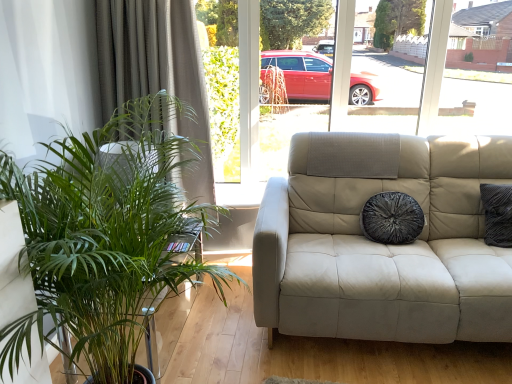
Image resolution: width=512 pixels, height=384 pixels. What do you see at coordinates (106, 236) in the screenshot? I see `green leafy plant at left` at bounding box center [106, 236].

Where is `green fabric curtain at left`? green fabric curtain at left is located at coordinates (157, 72).

Would you say green fabric curtain at left is to the left or to the right of green leafy plant at left in the picture?

From the image, it's evident that green fabric curtain at left is to the left of green leafy plant at left.

In terms of height, does green fabric curtain at left look taller or shorter compared to green leafy plant at left?

Clearly, green fabric curtain at left is taller compared to green leafy plant at left.

Is point (174, 20) positioned before point (21, 175)?

No.

From a real-world perspective, is green fabric curtain at left above or below green leafy plant at left?

From a real-world perspective, green fabric curtain at left is physically above green leafy plant at left.

Which of these two, velvety black pillow at center or green fabric curtain at left, is smaller?

velvety black pillow at center is smaller.

Is velvety black pillow at center spatially inside green fabric curtain at left, or outside of it?

velvety black pillow at center exists outside the volume of green fabric curtain at left.

Which object is positioned more to the left, velvety black pillow at center or green fabric curtain at left?

Positioned to the left is green fabric curtain at left.

Considering the positions of objects velvety black pillow at center and green fabric curtain at left in the image provided, who is behind, velvety black pillow at center or green fabric curtain at left?

green fabric curtain at left is more distant.

From a real-world perspective, does green leafy plant at left stand above velvety black pillow at center?

Correct, in the physical world, green leafy plant at left is higher than velvety black pillow at center.

Is green leafy plant at left at the left side of velvety black pillow at center?

Indeed, green leafy plant at left is positioned on the left side of velvety black pillow at center.

From the image's perspective, is green leafy plant at left located above velvety black pillow at center?

No, from the image's perspective, green leafy plant at left is not above velvety black pillow at center.

Considering the sizes of velvety black pillow at center and green leafy plant at left in the image, is velvety black pillow at center taller or shorter than green leafy plant at left?

In the image, velvety black pillow at center appears to be shorter than green leafy plant at left.

Considering the positions of point (393, 243) and point (106, 153), is point (393, 243) closer or farther from the camera than point (106, 153)?

Point (393, 243) is farther from the camera than point (106, 153).

How many degrees apart are the facing directions of velvety black pillow at center and green leafy plant at left?

96.1 degrees separate the facing orientations of velvety black pillow at center and green leafy plant at left.

Is velvety black pillow at center oriented away from green leafy plant at left?

No, velvety black pillow at center is not facing away from green leafy plant at left.

Is green leafy plant at left shorter than green fabric curtain at left?

Indeed, green leafy plant at left has a lesser height compared to green fabric curtain at left.

From a real-world perspective, which object stands above the other?

green fabric curtain at left.

Does green leafy plant at left have a lesser width compared to green fabric curtain at left?

No, green leafy plant at left is not thinner than green fabric curtain at left.

From the image's perspective, is green leafy plant at left below green fabric curtain at left?

Indeed, from the image's perspective, green leafy plant at left is shown beneath green fabric curtain at left.

Looking at this image, between green fabric curtain at left and velvety black pillow at center, which one appears on the left side from the viewer's perspective?

green fabric curtain at left.

Can you confirm if green fabric curtain at left is smaller than velvety black pillow at center?

No, green fabric curtain at left is not smaller than velvety black pillow at center.

Considering the sizes of objects green fabric curtain at left and velvety black pillow at center in the image provided, who is taller, green fabric curtain at left or velvety black pillow at center?

green fabric curtain at left.

I want to click on houseplant in front of the green fabric curtain at left, so click(106, 236).

Find the location of a particular element. curtain above the velvety black pillow at center (from a real-world perspective) is located at coordinates (157, 72).

Looking at this image, when comparing their distances from green leafy plant at left, does velvety black pillow at center or green fabric curtain at left seem further?

velvety black pillow at center lies further to green leafy plant at left than the other object.

When comparing their distances from velvety black pillow at center, does green fabric curtain at left or green leafy plant at left seem closer?

green fabric curtain at left is positioned closer to the anchor velvety black pillow at center.

Which object lies further to the anchor point green fabric curtain at left, velvety black pillow at center or green leafy plant at left?

velvety black pillow at center is positioned further to the anchor green fabric curtain at left.

When comparing their distances from green fabric curtain at left, does green leafy plant at left or velvety black pillow at center seem further?

velvety black pillow at center is further to green fabric curtain at left.

Looking at the image, which one is located further to velvety black pillow at center, green leafy plant at left or green fabric curtain at left?

The object further to velvety black pillow at center is green leafy plant at left.

Which object lies further to the anchor point green leafy plant at left, green fabric curtain at left or velvety black pillow at center?

Among the two, velvety black pillow at center is located further to green leafy plant at left.

This screenshot has height=384, width=512. In order to click on pillow located between green leafy plant at left and green fabric curtain at left in the depth direction in this screenshot , I will do `click(392, 218)`.